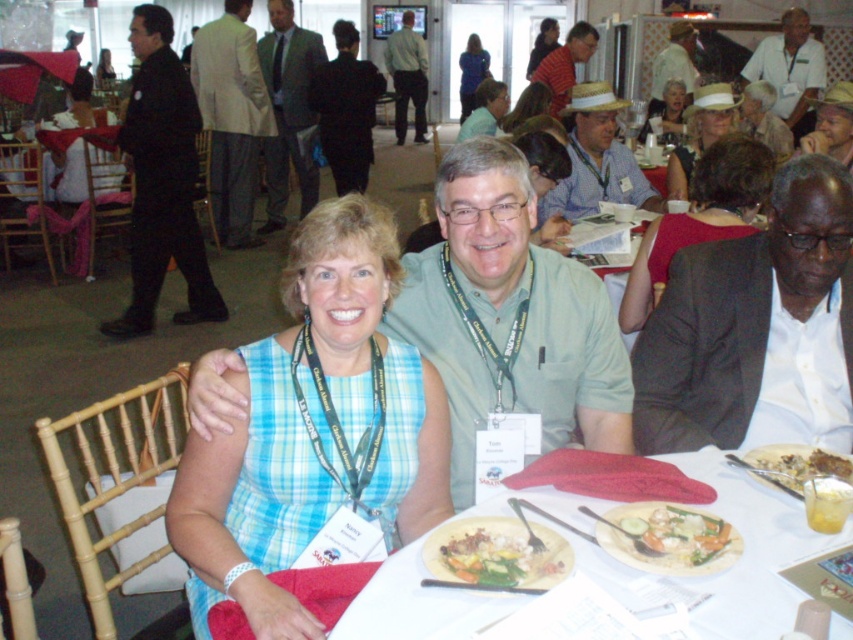
You are standing in the banquet hall and want to hand a gift to the person wearing the green textured suit at center. If you can walk 2 feet per second, how many seconds will it take you to reach them?

The distance between you and the green textured suit at center is 20.64 feet. Since you walk at 2 feet per second, it will take 20.64 divided by 2, which equals 10.32 seconds to reach them.

You are standing at the entrance of the banquet hall and see two points marked in the image. Which point, point (x=302, y=124) or point (x=801, y=477), is closer to you?

Point (x=302, y=124) is closer to you because it is further to the viewer than point (x=801, y=477).

You are a guest at this event and want to choose between the white creamy pasta at center and the white creamy mashed potatoes at lower right based on their height. Which one should you pick if you prefer taller dishes?

You should pick the white creamy pasta at center because it is taller than the white creamy mashed potatoes at lower right.